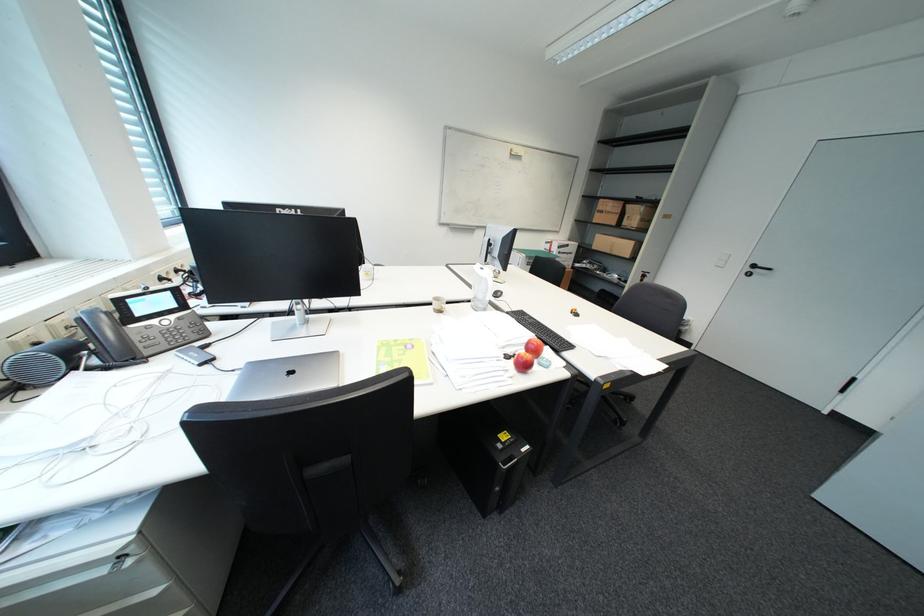
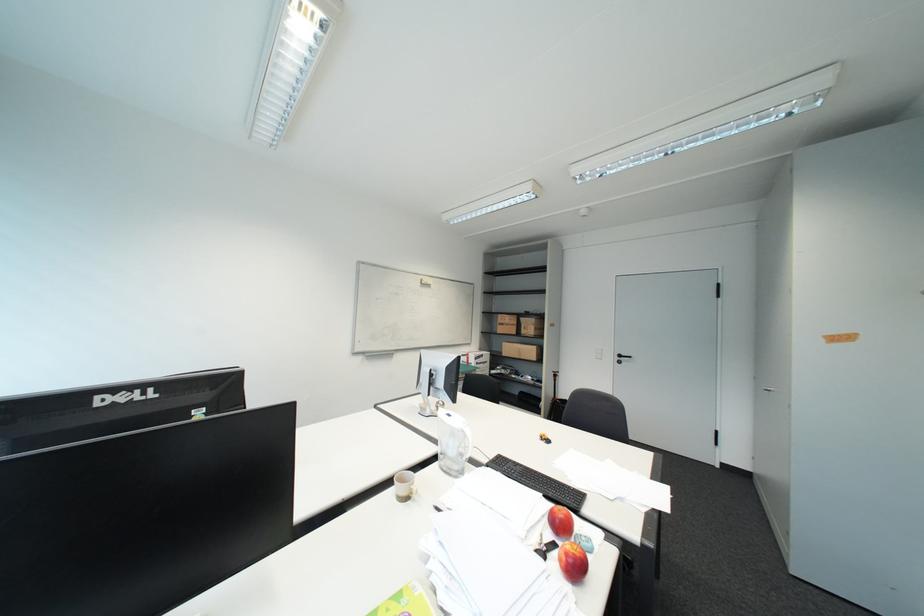
The first image is from the beginning of the video and the second image is from the end. How did the camera likely rotate when shooting the video?

The camera rotated toward right-up.